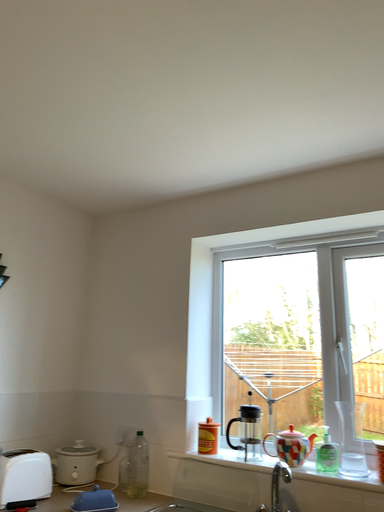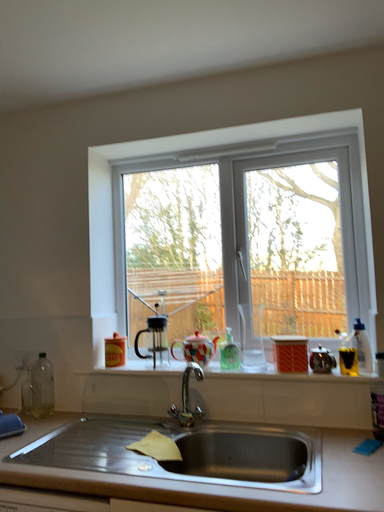
Question: Which way did the camera rotate in the video?

Choices:
 (A) rotated upward
 (B) rotated downward

Answer: (B)